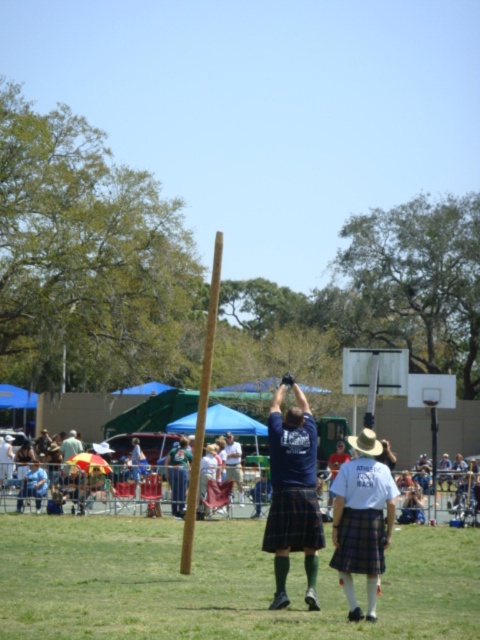
You are at the Highland Games and see two kilts at center. Which one is to the left of the other? The plaid fabric kilt at center and the red plaid kilt at center are both visible. Can you determine their positions?

The plaid fabric kilt at center is to the right of the red plaid kilt at center, so the red plaid kilt at center is on the left side.

You are a photographer at the Highland Games event. You need to capture a closeup shot of the plaid kilt at center and the plaid fabric kilt at center. Which kilt should you focus on first if you want to prioritize the one closer to you?

The plaid kilt at center is closer to you because its width appears smaller than the plaid fabric kilt at center, which is wider and likely farther away.